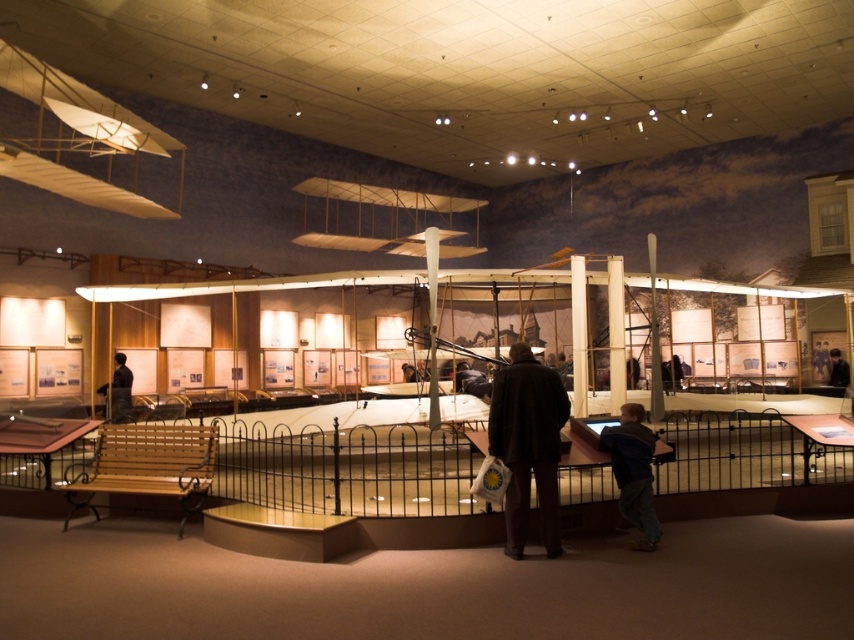
Does blue denim jacket at lower right appear under dark brown leather jacket at lower left?

Correct, blue denim jacket at lower right is located below dark brown leather jacket at lower left.

Is point (623, 422) positioned before point (110, 410)?

Yes, it is in front of point (110, 410).

Is point (623, 492) farther from camera compared to point (101, 385)?

No.

Image resolution: width=854 pixels, height=640 pixels. Find the location of `blue denim jacket at lower right`. blue denim jacket at lower right is located at coordinates (635, 472).

Between point (648, 461) and point (839, 364), which one is positioned behind?

Positioned behind is point (839, 364).

Does blue denim jacket at lower right appear on the right side of black leather jacket at center?

In fact, blue denim jacket at lower right is to the left of black leather jacket at center.

Is point (612, 465) positioned after point (839, 360)?

No, it is not.

Image resolution: width=854 pixels, height=640 pixels. I want to click on blue denim jacket at lower right, so click(x=635, y=472).

Measure the distance between dark brown coat at center and camera.

They are 5.11 meters apart.

Does dark brown coat at center have a larger size compared to blue denim jacket at lower right?

Correct, dark brown coat at center is larger in size than blue denim jacket at lower right.

Between point (522, 394) and point (636, 458), which one is positioned behind?

Point (636, 458)

In order to click on dark brown coat at center in this screenshot , I will do `click(528, 444)`.